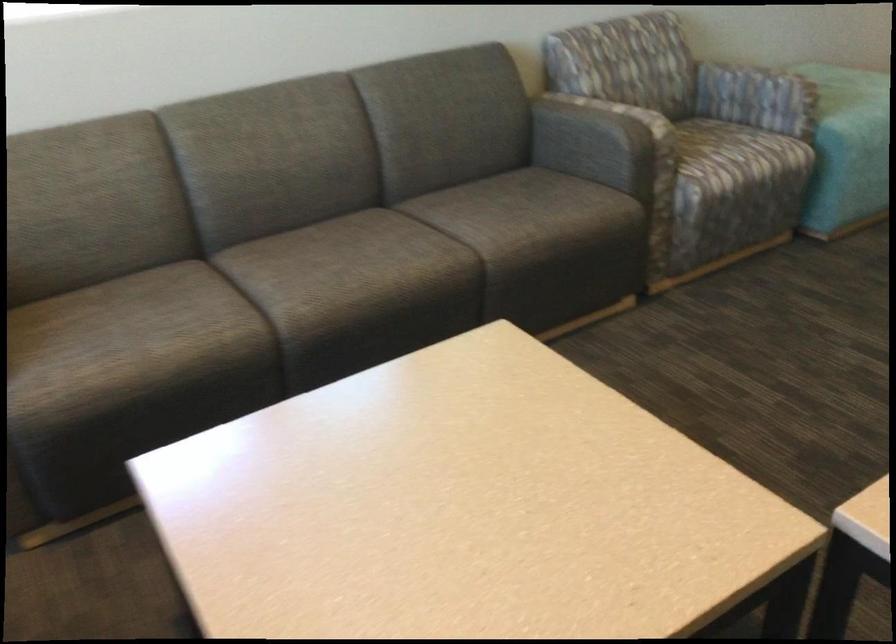
What do you see at coordinates (427, 269) in the screenshot? Image resolution: width=896 pixels, height=644 pixels. I see `the grey sofa sitting surface` at bounding box center [427, 269].